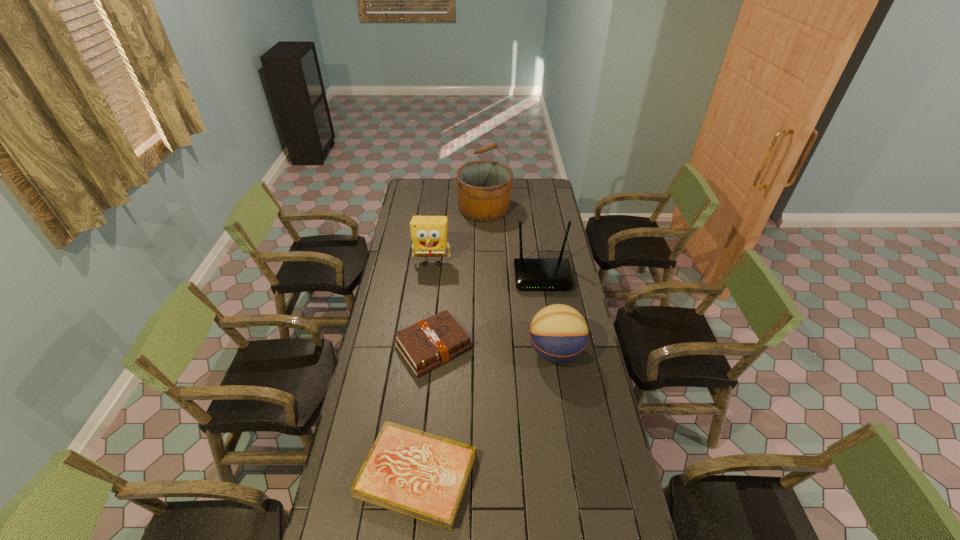
You are a GUI agent. You are given a task and a screenshot of the screen. Output one action in this format:
    pyautogui.click(x=<x>, y=<y>)
    Task: Click on the farthest object
    
    Given the screenshot: What is the action you would take?
    pyautogui.click(x=484, y=187)

Locate an element on the screen. Image resolution: width=960 pixels, height=540 pixels. bucket is located at coordinates (484, 187).

The width and height of the screenshot is (960, 540). What are the coordinates of `router` in the screenshot? It's located at (530, 273).

Image resolution: width=960 pixels, height=540 pixels. Identify the location of sponge. (428, 233).

This screenshot has width=960, height=540. I want to click on basketball, so click(x=558, y=333).

This screenshot has width=960, height=540. What are the coordinates of `the farther hardback book` in the screenshot? It's located at (431, 342).

The height and width of the screenshot is (540, 960). Find the location of `the taller hardback book`. the taller hardback book is located at coordinates (431, 342).

Locate an element on the screen. The image size is (960, 540). the nearest object is located at coordinates (424, 476).

This screenshot has width=960, height=540. I want to click on the nearer hardback book, so click(x=424, y=476).

Identify the location of free space located 0.070m on the right of the tallest object. This screenshot has height=540, width=960. (523, 208).